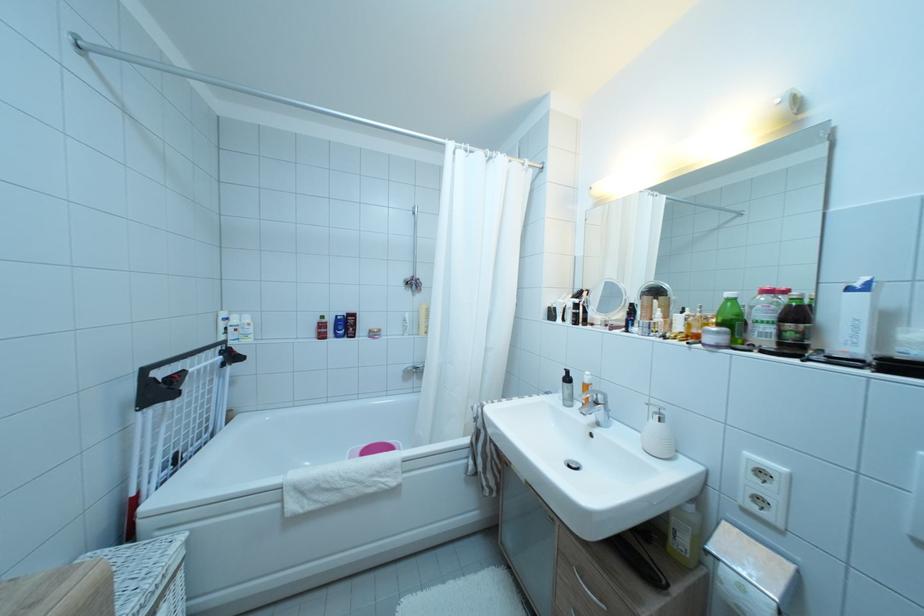
At what (x,y) coordinates should I click in order to perform the action: click on silver faucet handle. Please return your answer as a coordinate pair (x, y). Image resolution: width=924 pixels, height=616 pixels. Looking at the image, I should click on (593, 397).